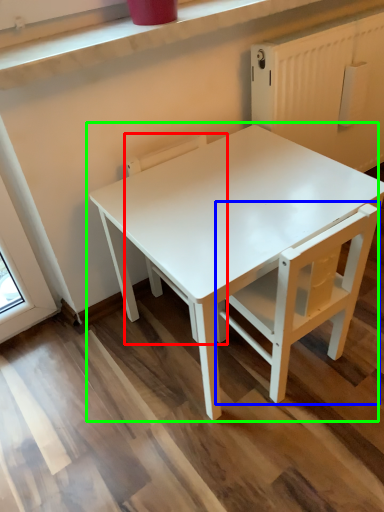
Question: Which is nearer to the chair (highlighted by a red box)? chair (highlighted by a blue box) or table (highlighted by a green box).

Choices:
 (A) chair
 (B) table

Answer: (A)